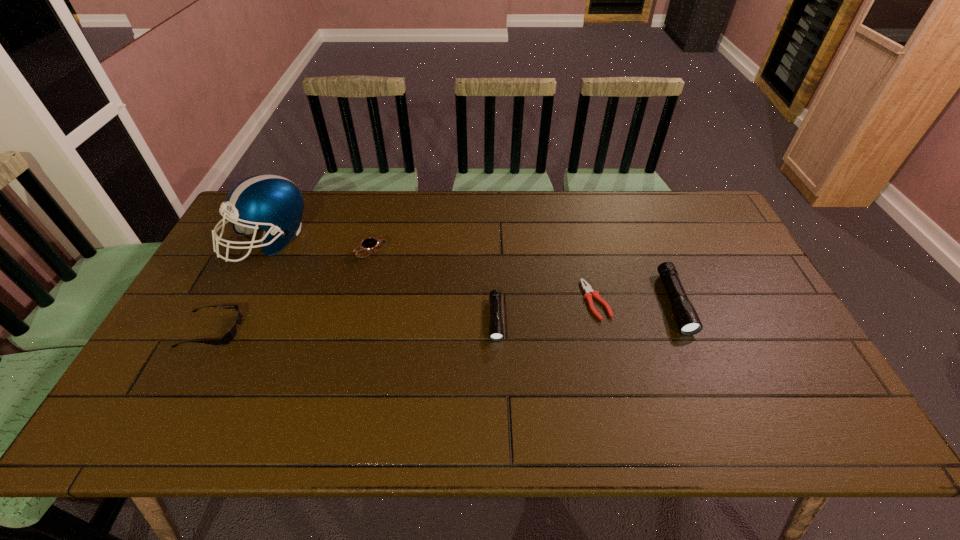
Observe the arrangement of all flashlights in the image. To keep them evenly spaced, where would you place another flashlight on the left? Please locate a free space. Please provide its 2D coordinates. Your answer should be formatted as a tuple, i.e. [(x, y)], where the tuple contains the x and y coordinates of a point satisfying the conditions above.

[(304, 336)]